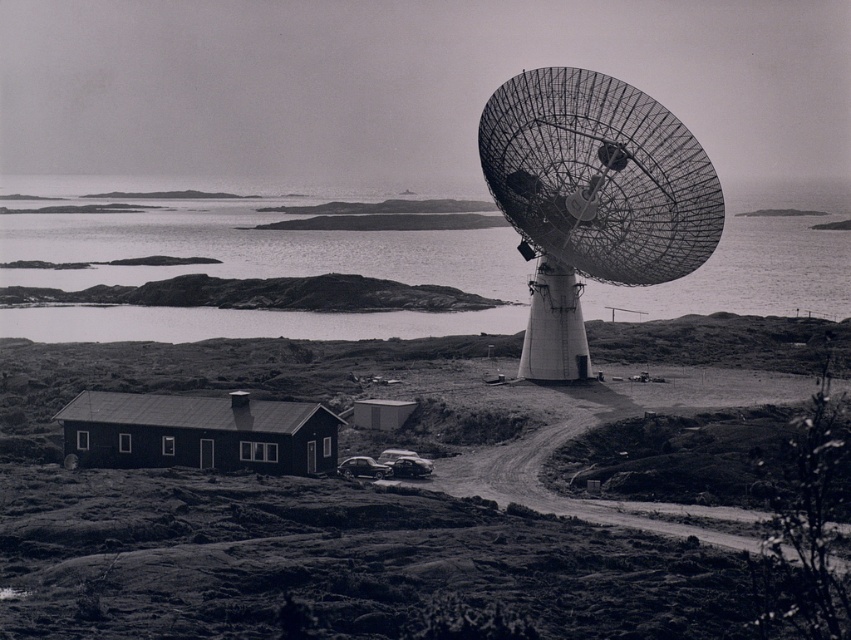
Can you confirm if reflective silver water at upper center is taller than metallic grid satellite at right?

Correct, reflective silver water at upper center is much taller as metallic grid satellite at right.

Is reflective silver water at upper center bigger than metallic grid satellite at right?

Yes.

Between point (721, 284) and point (518, 227), which one is positioned behind?

The point (721, 284) is more distant.

The image size is (851, 640). I want to click on reflective silver water at upper center, so click(x=253, y=268).

I want to click on metallic grid satellite at right, so click(x=592, y=196).

Find the location of a particular element. The height and width of the screenshot is (640, 851). metallic grid satellite at right is located at coordinates (592, 196).

Consider the image. Does reflective silver water at upper center come in front of shiny black car at center?

No, reflective silver water at upper center is behind shiny black car at center.

Which is behind, point (193, 250) or point (380, 468)?

Positioned behind is point (193, 250).

Measure the distance between reflective silver water at upper center and camera.

reflective silver water at upper center is 98.67 meters from camera.

Where is `reflective silver water at upper center`? This screenshot has height=640, width=851. reflective silver water at upper center is located at coordinates (253, 268).